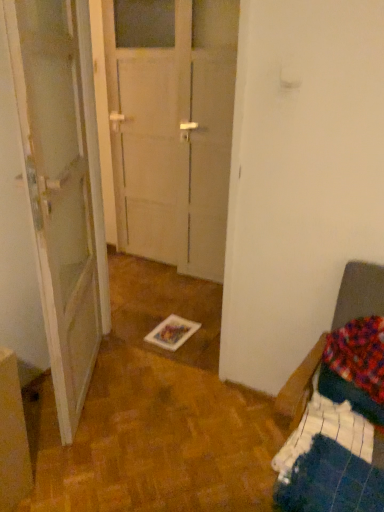
At what (x,y) coordinates should I click in order to perform the action: click on vacant space underneath white glossy door at left (from a real-world perspective). Please return your answer as a coordinate pair (x, y). Looking at the image, I should click on (93, 388).